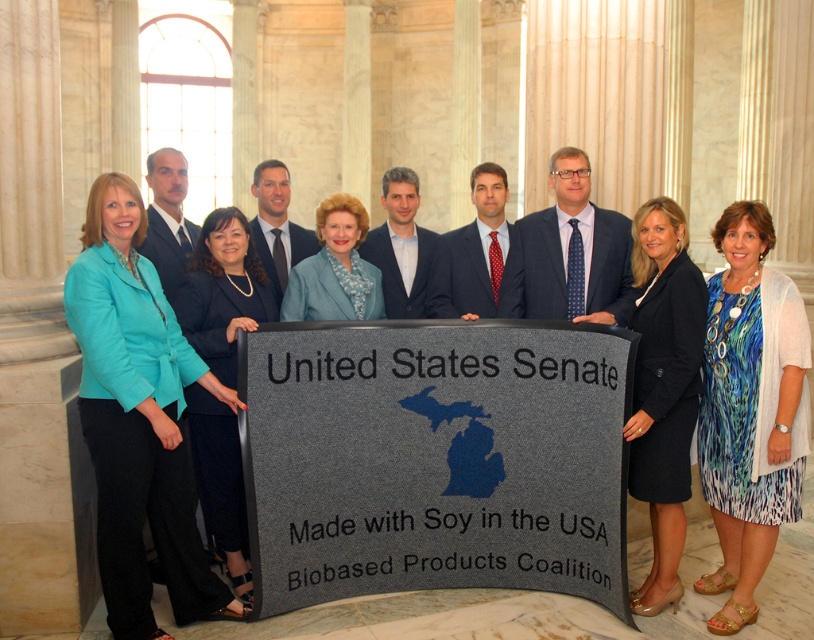
Question: Is blue textured suit at center wider than blue textured blazer at center?

Choices:
 (A) yes
 (B) no

Answer: (A)

Question: Does blue printed dress at center appear over black fabric dress at center?

Choices:
 (A) yes
 (B) no

Answer: (B)

Question: Does black fabric dress at center have a lesser width compared to teal fabric jacket at left?

Choices:
 (A) yes
 (B) no

Answer: (B)

Question: Among these objects, which one is farthest from the camera?

Choices:
 (A) teal fabric jacket at left
 (B) gray fabric sign at center
 (C) blue textured blazer at center

Answer: (C)

Question: Based on their relative distances, which object is farther from the teal fabric jacket at center?

Choices:
 (A) blue printed dress at center
 (B) teal fabric jacket at left
 (C) blue textured suit at center

Answer: (A)

Question: Which point appears closest to the camera in this image?

Choices:
 (A) (607, 452)
 (B) (360, 280)
 (C) (182, 308)

Answer: (A)